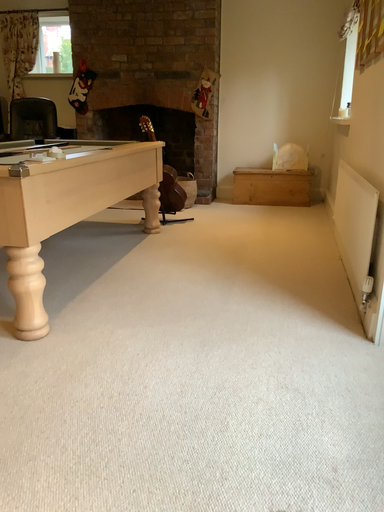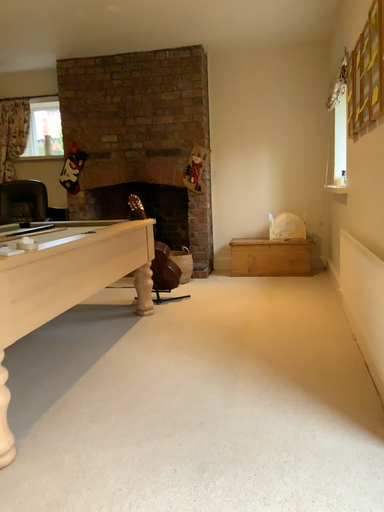
Question: How did the camera likely rotate when shooting the video?

Choices:
 (A) rotated downward
 (B) rotated upward

Answer: (B)